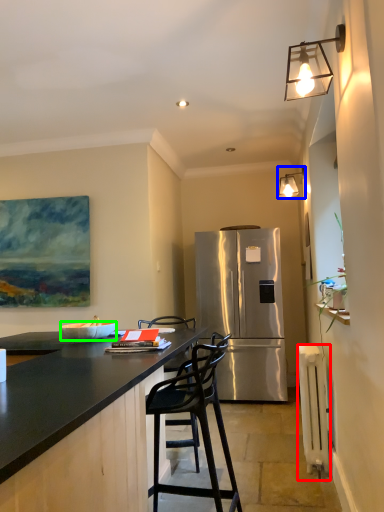
Question: Which object is the farthest from radiator (highlighted by a red box)? Choose among these: lamp (highlighted by a blue box) or bowl (highlighted by a green box).

Choices:
 (A) lamp
 (B) bowl

Answer: (A)